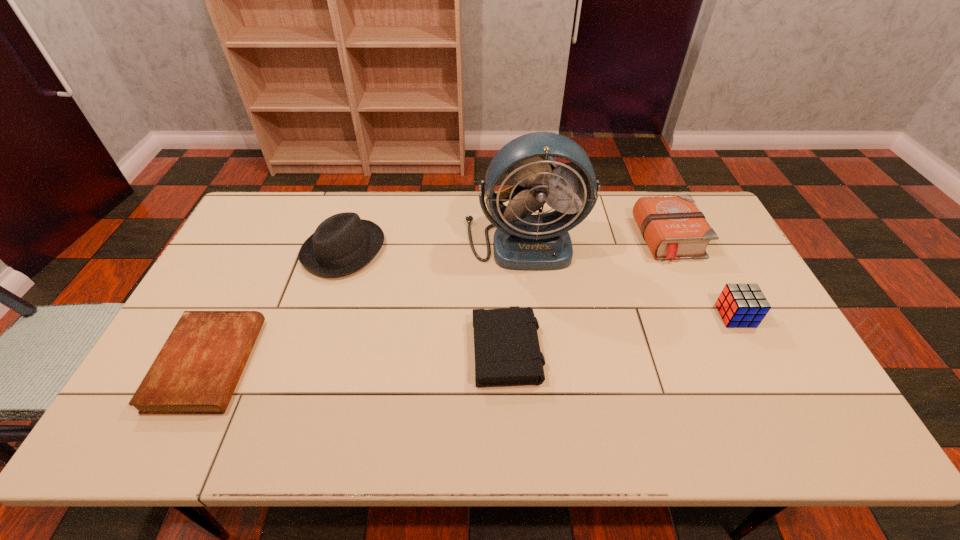
Where is `free space at the near left corner of the desktop`? Image resolution: width=960 pixels, height=540 pixels. free space at the near left corner of the desktop is located at coordinates (140, 434).

In the image, there is a desktop. Identify the location of vacant space at the far right corner. (710, 220).

The height and width of the screenshot is (540, 960). Identify the location of vacant area between the shortest object and the second tallest Bible. (358, 355).

Where is `vacant region between the second tallest object and the tallest object`? vacant region between the second tallest object and the tallest object is located at coordinates (434, 246).

In order to click on vacant space in between the rightmost Bible and the second Bible from left to right in this screenshot , I will do 589,293.

Locate an element on the screen. The image size is (960, 540). free space between the farthest Bible and the cube is located at coordinates (704, 277).

Identify the location of vacant space that is in between the leftmost Bible and the tallest object. (366, 302).

Locate an element on the screen. This screenshot has width=960, height=540. free space that is in between the tallest object and the cube is located at coordinates (630, 278).

At what (x,y) coordinates should I click in order to perform the action: click on empty space between the shortest Bible and the cube. Please return your answer as a coordinate pair (x, y). Looking at the image, I should click on (472, 340).

Find the location of a particular element. The image size is (960, 540). vacant area that lies between the shortest Bible and the second tallest object is located at coordinates [x=276, y=307].